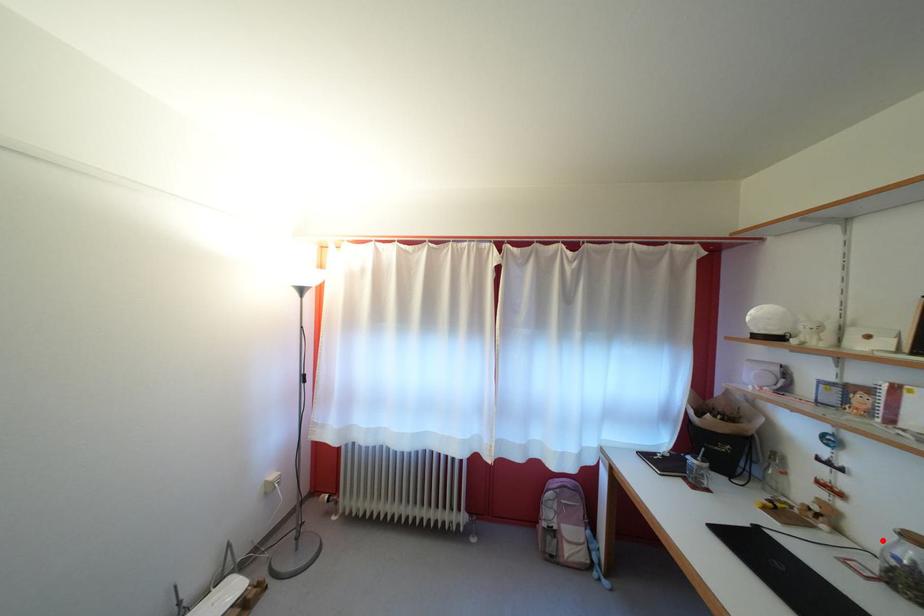
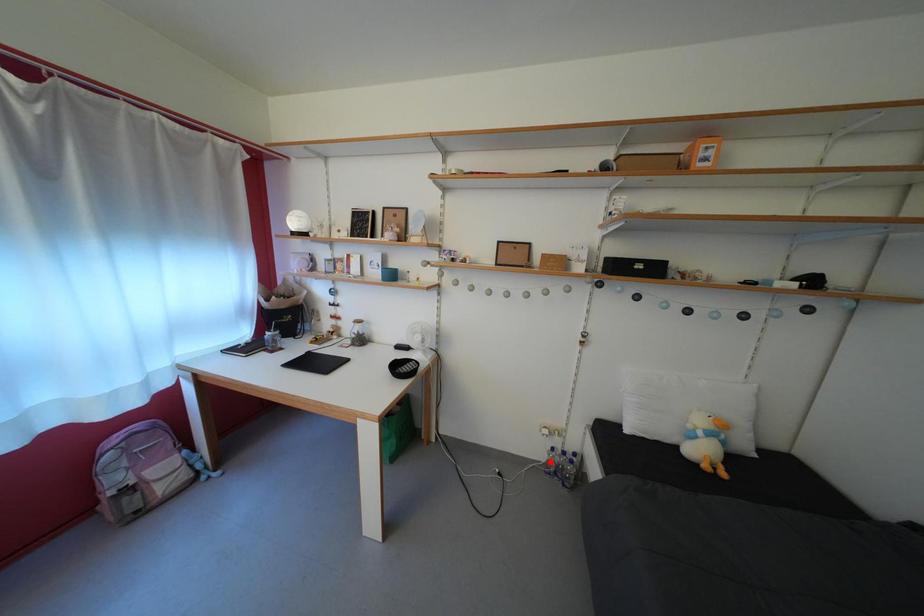
I am providing you with two images of the same scene from different viewpoints. A red point is marked on the first image and another point is marked on the second image. Is the red point in image1 aligned with the point shown in image2?

No